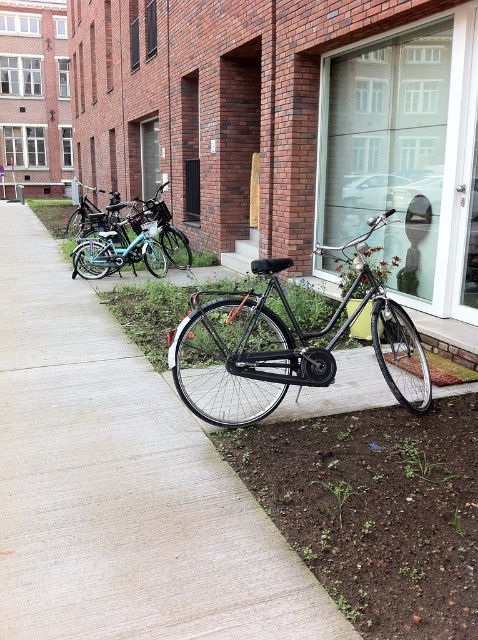
Question: Is matte black bicycle at center smaller than shiny black bicycle at center?

Choices:
 (A) yes
 (B) no

Answer: (B)

Question: Is matte black bicycle at center bigger than shiny black bicycle at center?

Choices:
 (A) no
 (B) yes

Answer: (B)

Question: Among these objects, which one is nearest to the camera?

Choices:
 (A) shiny teal bicycle at center-left
 (B) shiny black bicycle at center

Answer: (B)

Question: Is matte black bicycle at center thinner than shiny black bicycle at center?

Choices:
 (A) no
 (B) yes

Answer: (A)

Question: Estimate the real-world distances between objects in this image. Which object is closer to the shiny teal bicycle at center-left?

Choices:
 (A) shiny black bicycle at center
 (B) matte black bicycle at center

Answer: (B)

Question: Based on their relative distances, which object is nearer to the shiny teal bicycle at center-left?

Choices:
 (A) matte black bicycle at center
 (B) shiny black bicycle at center

Answer: (A)